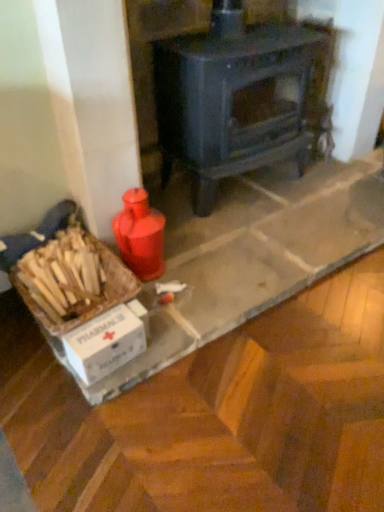
Where is `vacant space to the right of white cardboard box at lower left`? The height and width of the screenshot is (512, 384). vacant space to the right of white cardboard box at lower left is located at coordinates click(154, 350).